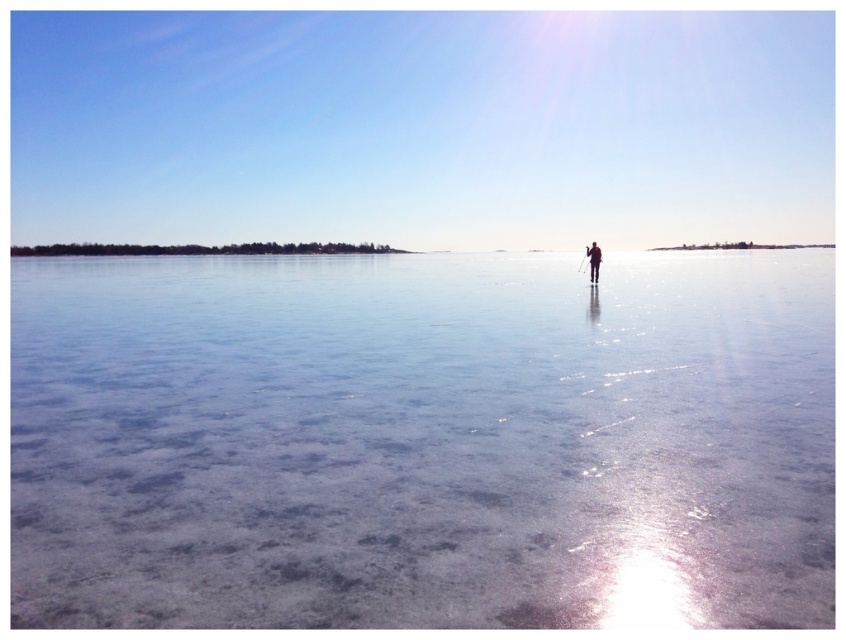
Question: Where is transparent ice at center located in relation to silhouette figure at center in the image?

Choices:
 (A) right
 (B) left

Answer: (B)

Question: In this image, where is transparent ice at center located relative to silhouette figure at center?

Choices:
 (A) below
 (B) above

Answer: (B)

Question: Which object is closer to the camera taking this photo?

Choices:
 (A) silhouette figure at center
 (B) transparent ice at center

Answer: (B)

Question: Does transparent ice at center appear under silhouette figure at center?

Choices:
 (A) yes
 (B) no

Answer: (B)